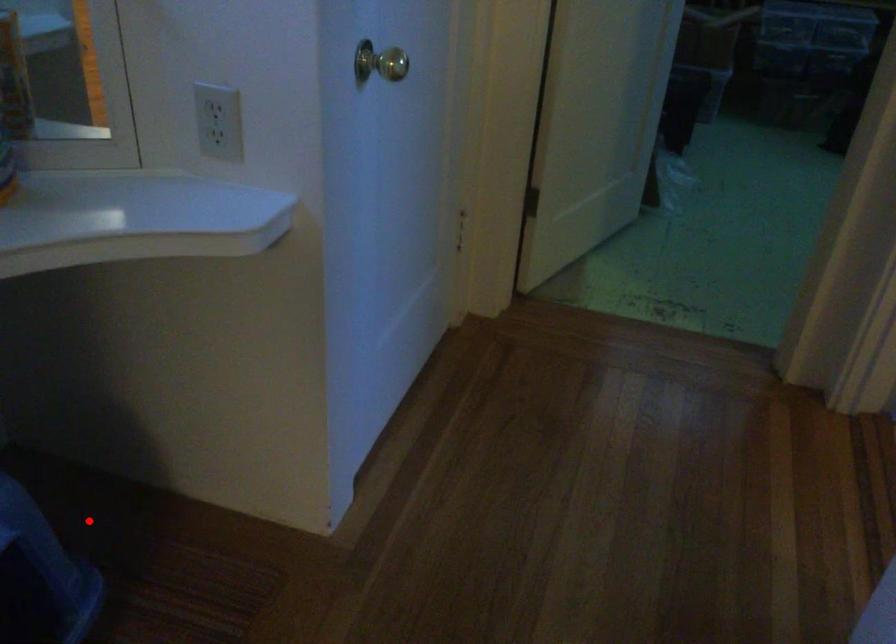
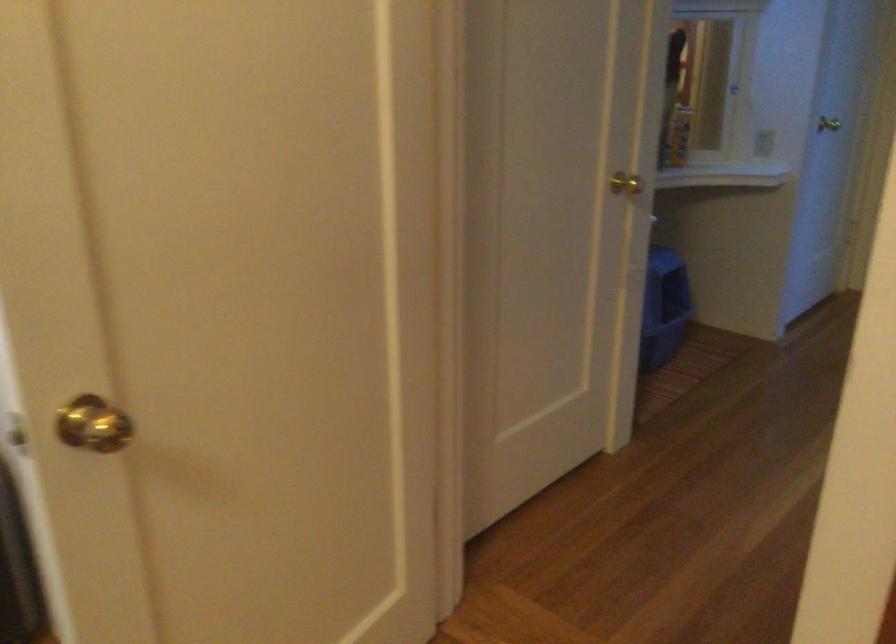
Question: I am providing you with two images of the same scene from different viewpoints. Image1 has a red point marked. In image2, the corresponding 3D location appears at what relative position? Reply with the corresponding letter.

Choices:
 (A) Closer
 (B) Farther

Answer: (B)